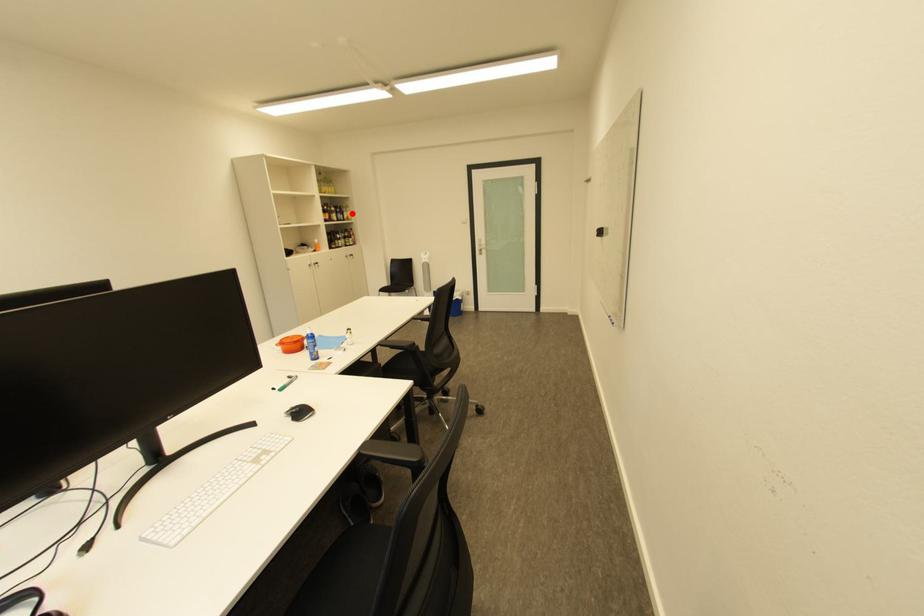
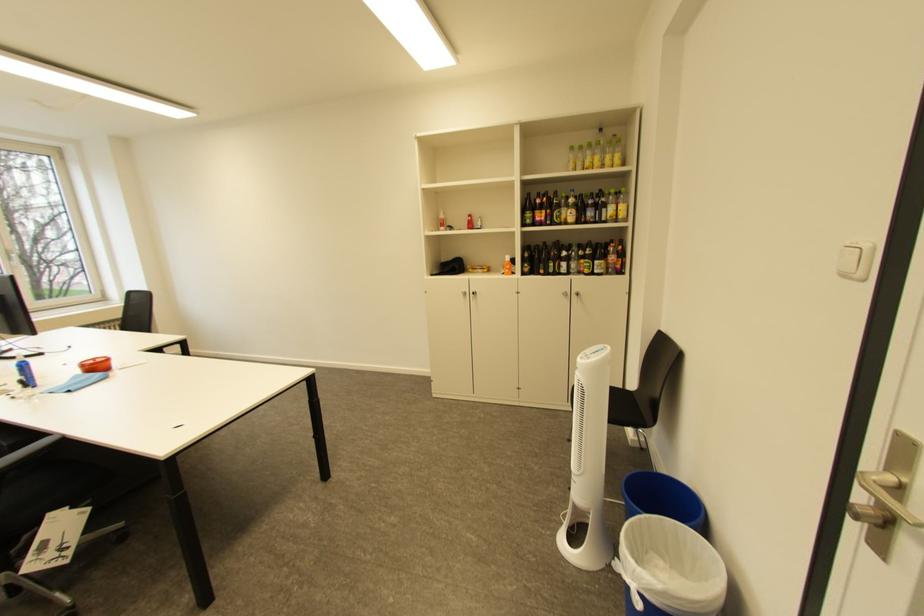
Question: I am providing you with two images of the same scene from different viewpoints. A red point is shown in image1. For the corresponding object point in image2, is it positioned nearer or farther from the camera?

Choices:
 (A) Nearer
 (B) Farther

Answer: (B)